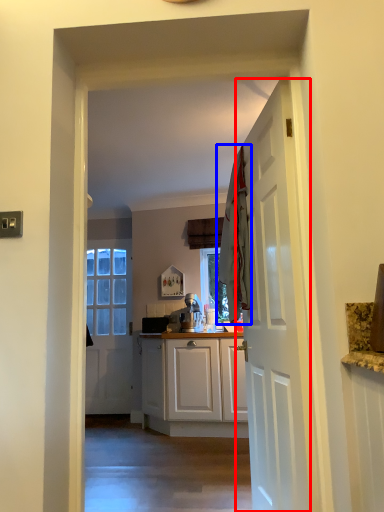
Question: Among these objects, which one is farthest to the camera, door (highlighted by a red box) or laundry (highlighted by a blue box)?

Choices:
 (A) door
 (B) laundry

Answer: (B)